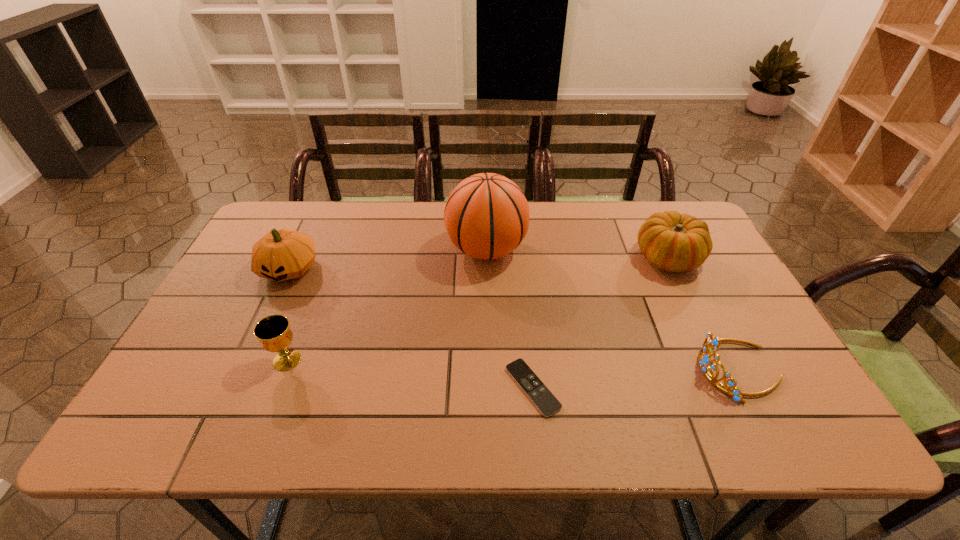
The width and height of the screenshot is (960, 540). Identify the location of the tallest object. click(486, 216).

The width and height of the screenshot is (960, 540). Identify the location of the left gourd. (283, 254).

Where is `the right gourd`? The image size is (960, 540). the right gourd is located at coordinates (672, 242).

The image size is (960, 540). I want to click on chalice, so 273,332.

Identify the location of tiara. (710, 342).

You are a GUI agent. You are given a task and a screenshot of the screen. Output one action in this format:
    pyautogui.click(x=<x>, y=<y>)
    Task: Click on the remote control
    
    Given the screenshot: What is the action you would take?
    pyautogui.click(x=539, y=394)

Locate an element on the screen. This screenshot has width=960, height=540. free space located 0.250m on the front of the tallest object is located at coordinates (488, 346).

Identify the location of vacant space positioned on the side of the left gourd with the carved face. (271, 309).

Find the location of `free location located on the left of the right gourd`. free location located on the left of the right gourd is located at coordinates (526, 258).

Where is `free location located 0.150m on the front of the chalice`? The image size is (960, 540). free location located 0.150m on the front of the chalice is located at coordinates (258, 434).